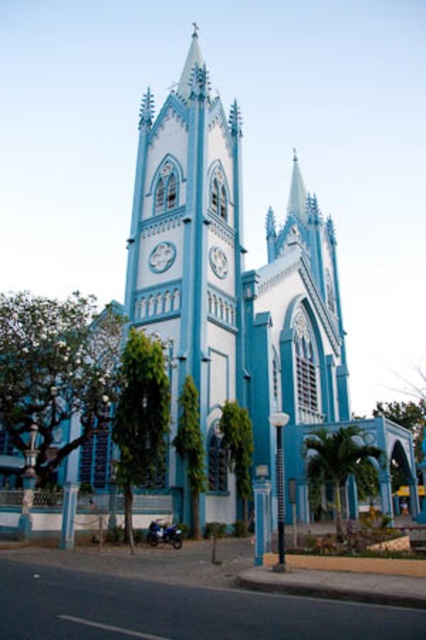
Question: Does metallic silver clock at center have a larger size compared to white glossy clock at center?

Choices:
 (A) yes
 (B) no

Answer: (B)

Question: Does metallic silver clock at center lie behind white glossy clock at center?

Choices:
 (A) no
 (B) yes

Answer: (B)

Question: Which point is closer to the camera taking this photo?

Choices:
 (A) (150, 260)
 (B) (222, 276)
 (C) (238, 186)

Answer: (A)

Question: Can you confirm if blue painted stone tower at center is smaller than metallic silver clock at center?

Choices:
 (A) no
 (B) yes

Answer: (A)

Question: Based on their relative distances, which object is nearer to the white glossy clock at center?

Choices:
 (A) metallic silver clock at center
 (B) blue painted stone tower at center

Answer: (A)

Question: Which of these objects is positioned farthest from the metallic silver clock at center?

Choices:
 (A) white glossy clock at center
 (B) blue painted stone tower at center

Answer: (B)